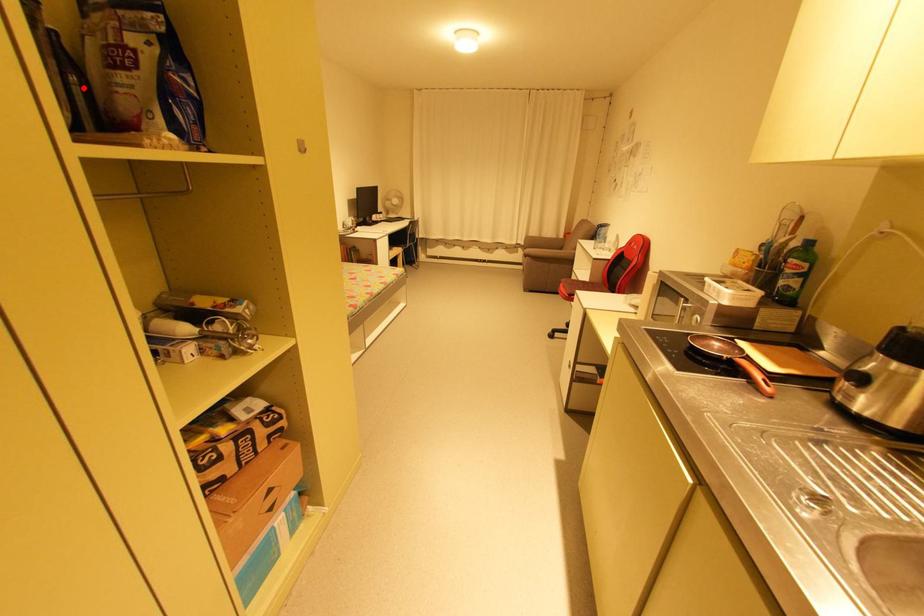
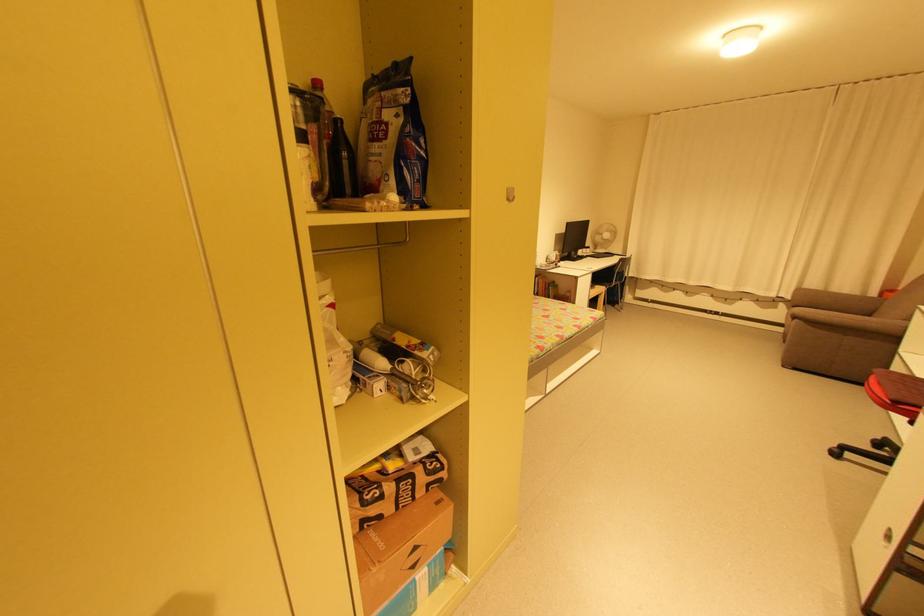
The point at the highlighted location is marked in the first image. Where is the corresponding point in the second image?

(350, 161)